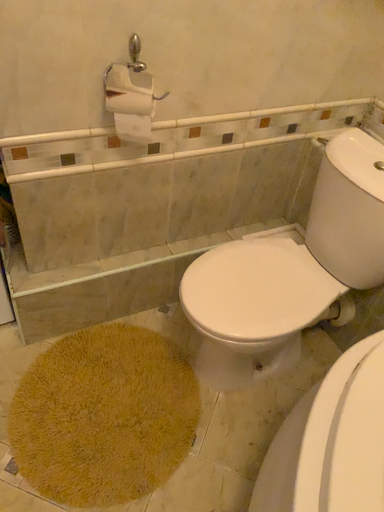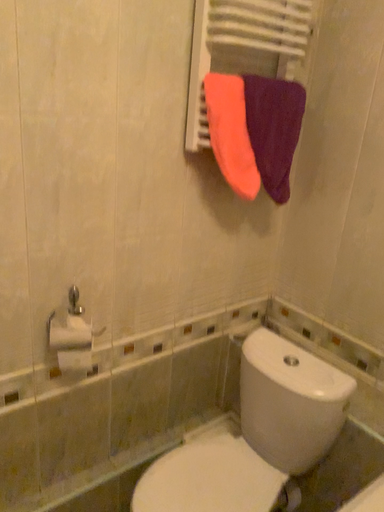
Question: How did the camera likely rotate when shooting the video?

Choices:
 (A) rotated left
 (B) rotated right

Answer: (B)